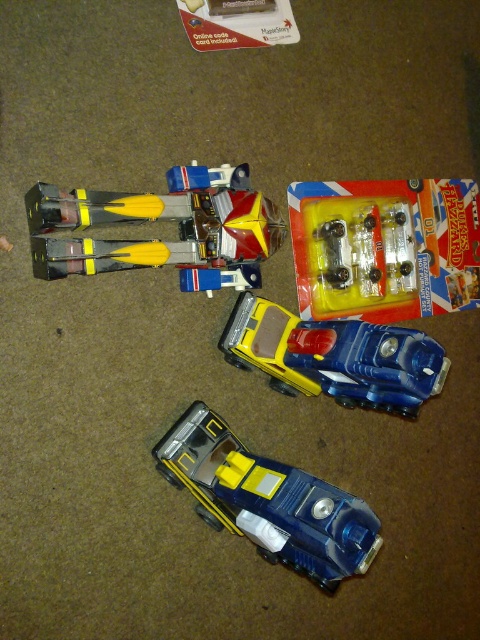
Question: Estimate the real-world distances between objects in this image. Which object is closer to the yellow matte truck at upper center?

Choices:
 (A) clear plastic car at upper center
 (B) glossy plastic car at center

Answer: (B)

Question: Can you confirm if clear plastic car at upper center is positioned above yellow matte truck at upper center?

Choices:
 (A) no
 (B) yes

Answer: (B)

Question: Which object appears farthest from the camera in this image?

Choices:
 (A) clear plastic car at upper center
 (B) glossy plastic car at center
 (C) shiny plastic robot at center

Answer: (A)

Question: Which object appears closest to the camera in this image?

Choices:
 (A) yellow matte truck at upper center
 (B) clear plastic car at upper center

Answer: (A)

Question: Does clear plastic car at upper center appear under yellow matte truck at upper center?

Choices:
 (A) yes
 (B) no

Answer: (B)

Question: Does clear plastic car at upper center have a greater width compared to yellow matte truck at upper center?

Choices:
 (A) yes
 (B) no

Answer: (A)